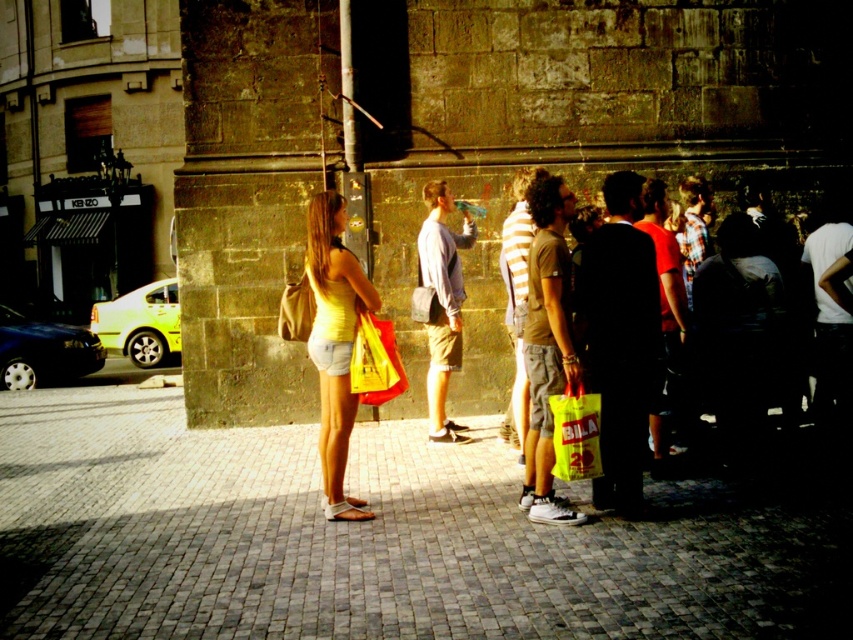
You are a pedestrian walking along the cobblestone street and see both the light blue cotton shirt at center and the yellow plastic bag at center. Which object is closer to you?

The light blue cotton shirt at center is closer to you because the yellow plastic bag at center is behind it.

Based on the photo, you need to place a new bench that is 1.5 meters long on the cobblestone street. The bench must be placed such that it does not block the metallic pole at center. Where should you position the bench to ensure it fits without overlapping the pole?

The metallic pole at center is located at coordinates approximately 0.239 on the x and 0.415 on the y axis. To place the bench without overlapping, position it either to the left or right of the pole, ensuring the bench stays within the street area while avoiding the pole.